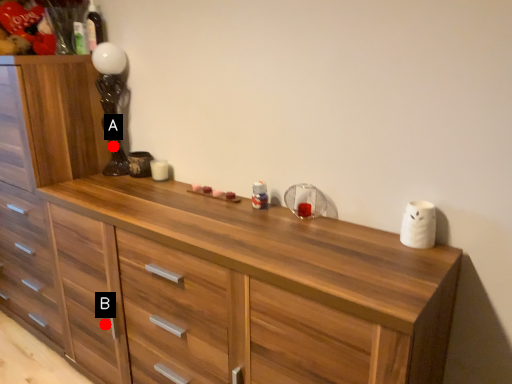
Question: Two points are circled on the image, labeled by A and B beside each circle. Which point is farther from the camera taking this photo?

Choices:
 (A) A is further
 (B) B is further

Answer: (A)